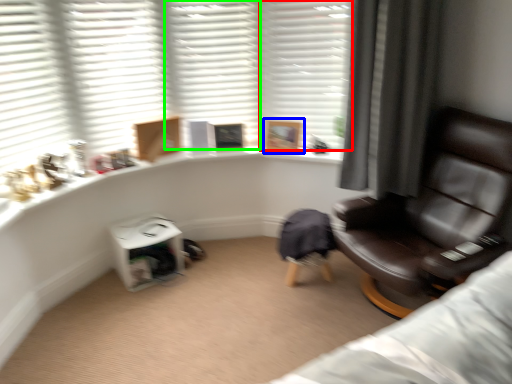
Question: Based on their relative distances, which object is farther from shutter (highlighted by a red box)? Choose from picture frame (highlighted by a blue box) and shutter (highlighted by a green box).

Choices:
 (A) picture frame
 (B) shutter

Answer: (A)